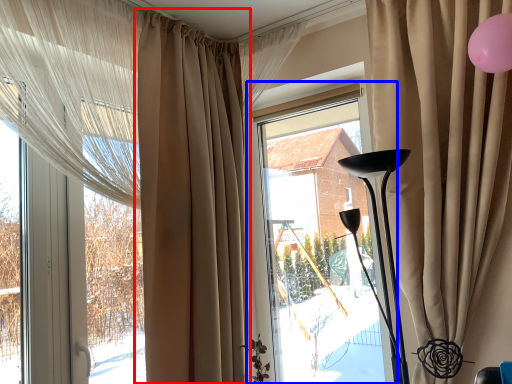
Question: Which object appears farthest to the camera in this image, curtain (highlighted by a red box) or window (highlighted by a blue box)?

Choices:
 (A) curtain
 (B) window

Answer: (B)